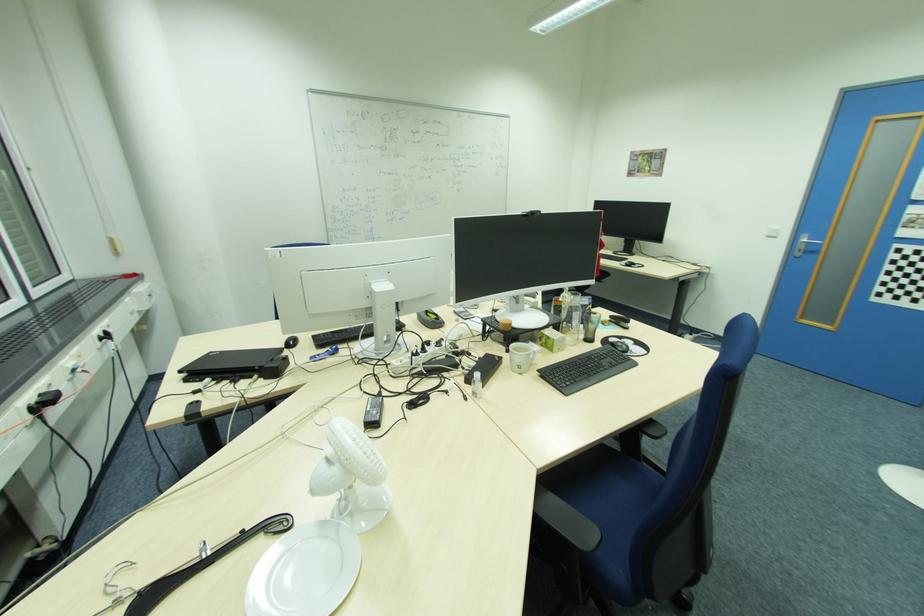
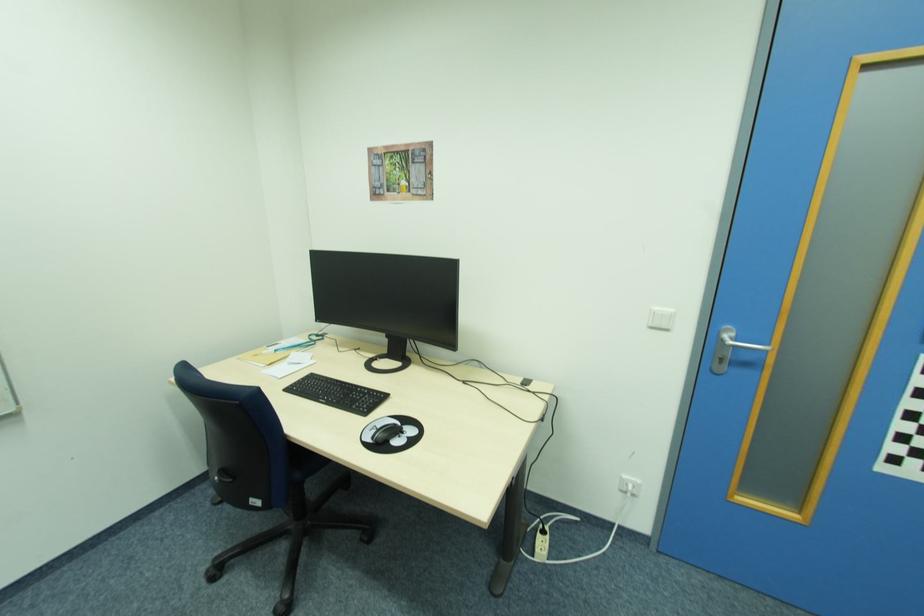
In the second image, find the point that corresponds to the point at 780,238 in the first image.

(670, 329)